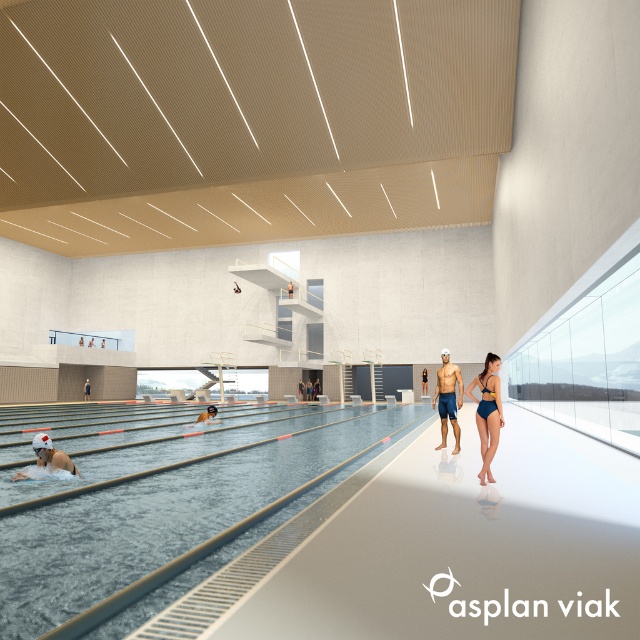
Question: Does blue matte swimsuit at center have a larger size compared to matte blue swimsuit at center?

Choices:
 (A) yes
 (B) no

Answer: (B)

Question: Considering the relative positions of white matte swim cap at lower left and matte blue swimsuit at center in the image provided, where is white matte swim cap at lower left located with respect to matte blue swimsuit at center?

Choices:
 (A) above
 (B) below

Answer: (A)

Question: Considering the real-world distances, which object is farthest from the matte blue swimsuit at center?

Choices:
 (A) white matte swim cap at lower left
 (B) matte blue swim trunks at center

Answer: (A)

Question: Among these points, which one is farthest from the camera?

Choices:
 (A) (214, 410)
 (B) (492, 376)

Answer: (A)

Question: Is black swim cap at center positioned in front of blue fabric swimmer at center?

Choices:
 (A) no
 (B) yes

Answer: (B)

Question: Estimate the real-world distances between objects in this image. Which object is farther from the white matte swim cap at lower left?

Choices:
 (A) clear blue water at center
 (B) matte blue swimsuit at center
 (C) blue fabric swimmer at center
 (D) blue matte swimsuit at center

Answer: (C)